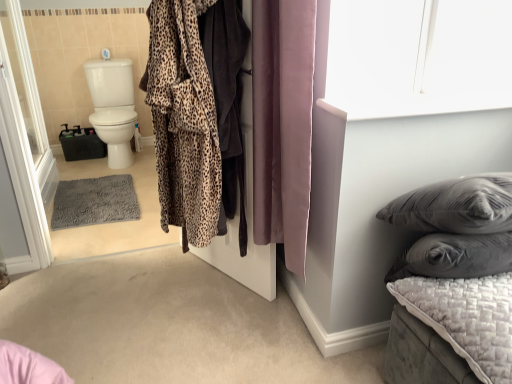
Describe the element at coordinates (453, 284) in the screenshot. I see `quilted gray cushion at lower right` at that location.

Locate an element on the screen. The image size is (512, 384). transparent glass screen door at left is located at coordinates (22, 172).

This screenshot has width=512, height=384. I want to click on quilted gray mattress at lower right, so click(x=466, y=318).

Identify the location of leopard print robe at center. This screenshot has height=384, width=512. (228, 101).

Is the depth of quilted gray mattress at lower right greater than that of leopard print plush bathrobe at center?

No, the depth of quilted gray mattress at lower right is less than that of leopard print plush bathrobe at center.

Is quilted gray mattress at lower right far from leopard print plush bathrobe at center?

That's not correct — quilted gray mattress at lower right is a little close to leopard print plush bathrobe at center.

From the image's perspective, is quilted gray mattress at lower right located beneath leopard print plush bathrobe at center?

Correct, quilted gray mattress at lower right appears lower than leopard print plush bathrobe at center in the image.

Can you confirm if quilted gray mattress at lower right is smaller than leopard print plush bathrobe at center?

Indeed, quilted gray mattress at lower right has a smaller size compared to leopard print plush bathrobe at center.

From a real-world perspective, is leopard print robe at center on top of purple velvet curtain at center?

No, from a real-world perspective, leopard print robe at center is not over purple velvet curtain at center

Is leopard print robe at center far away from purple velvet curtain at center?

That's not correct — leopard print robe at center is a little close to purple velvet curtain at center.

The height and width of the screenshot is (384, 512). Find the location of `cloak below the purple velvet curtain at center (from a real-world perspective)`. cloak below the purple velvet curtain at center (from a real-world perspective) is located at coordinates (228, 101).

Between transparent glass screen door at left and purple velvet curtain at center, which one has larger size?

transparent glass screen door at left.

Is transparent glass screen door at left spatially inside purple velvet curtain at center, or outside of it?

The correct answer is: outside.

Are transparent glass screen door at left and purple velvet curtain at center located far from each other?

Yes, transparent glass screen door at left and purple velvet curtain at center are located far from each other.

From a real-world perspective, is transparent glass screen door at left above or below purple velvet curtain at center?

In terms of real-world spatial position, transparent glass screen door at left is below purple velvet curtain at center.

Who is taller, leopard print plush bathrobe at center or leopard print robe at center?

Standing taller between the two is leopard print robe at center.

Considering the sizes of leopard print plush bathrobe at center and leopard print robe at center in the image, is leopard print plush bathrobe at center wider or thinner than leopard print robe at center?

Considering their sizes, leopard print plush bathrobe at center looks broader than leopard print robe at center.

Is leopard print plush bathrobe at center at the left side of leopard print robe at center?

Yes, leopard print plush bathrobe at center is to the left of leopard print robe at center.

Locate an element on the screen. This screenshot has width=512, height=384. bathrobe that appears above the leopard print robe at center (from the image's perspective) is located at coordinates (183, 121).

In the scene shown: From a real-world perspective, is quilted gray mattress at lower right located higher than purple velvet curtain at center?

No, from a real-world perspective, quilted gray mattress at lower right is not above purple velvet curtain at center.

Considering the positions of objects quilted gray mattress at lower right and purple velvet curtain at center in the image provided, who is more to the right, quilted gray mattress at lower right or purple velvet curtain at center?

Positioned to the right is quilted gray mattress at lower right.

From the image's perspective, which is below, quilted gray mattress at lower right or purple velvet curtain at center?

quilted gray mattress at lower right is shown below in the image.

Does quilted gray mattress at lower right turn towards purple velvet curtain at center?

No.

From a real-world perspective, is purple velvet curtain at center physically located above or below leopard print robe at center?

In terms of real-world spatial position, purple velvet curtain at center is above leopard print robe at center.

In the image, is purple velvet curtain at center on the left side or the right side of leopard print robe at center?

Clearly, purple velvet curtain at center is on the right of leopard print robe at center in the image.

Which is more to the left, quilted gray cushion at lower right or purple velvet curtain at center?

Positioned to the left is purple velvet curtain at center.

Can you confirm if quilted gray cushion at lower right is wider than purple velvet curtain at center?

Yes, quilted gray cushion at lower right is wider than purple velvet curtain at center.

Image resolution: width=512 pixels, height=384 pixels. Find the location of `mattress that is in front of the leopard print plush bathrobe at center`. mattress that is in front of the leopard print plush bathrobe at center is located at coordinates (466, 318).

Locate an element on the screen. The width and height of the screenshot is (512, 384). curtain positioned vertically above the leopard print robe at center (from a real-world perspective) is located at coordinates (283, 123).

Estimate the real-world distances between objects in this image. Which object is closer to quilted gray mattress at lower right, purple velvet curtain at center or quilted gray cushion at lower right?

Among the two, quilted gray cushion at lower right is located nearer to quilted gray mattress at lower right.

Based on their spatial positions, is transparent glass screen door at left or leopard print plush bathrobe at center further from quilted gray cushion at lower right?

transparent glass screen door at left.

Looking at the image, which one is located further to leopard print plush bathrobe at center, purple velvet curtain at center or quilted gray cushion at lower right?

quilted gray cushion at lower right.

Considering their positions, is leopard print robe at center positioned further to leopard print plush bathrobe at center than transparent glass screen door at left?

Among the two, transparent glass screen door at left is located further to leopard print plush bathrobe at center.

In the scene shown: From the image, which object appears to be farther from quilted gray cushion at lower right, leopard print plush bathrobe at center or quilted gray mattress at lower right?

Among the two, leopard print plush bathrobe at center is located further to quilted gray cushion at lower right.

From the image, which object appears to be farther from purple velvet curtain at center, leopard print robe at center or transparent glass screen door at left?

Among the two, transparent glass screen door at left is located further to purple velvet curtain at center.

Looking at the image, which one is located further to purple velvet curtain at center, quilted gray cushion at lower right or leopard print plush bathrobe at center?

quilted gray cushion at lower right lies further to purple velvet curtain at center than the other object.

Estimate the real-world distances between objects in this image. Which object is closer to quilted gray mattress at lower right, purple velvet curtain at center or leopard print robe at center?

purple velvet curtain at center lies closer to quilted gray mattress at lower right than the other object.

This screenshot has height=384, width=512. I want to click on mattress between transparent glass screen door at left and quilted gray cushion at lower right, so click(x=466, y=318).

The image size is (512, 384). Find the location of `cloak situated between leopard print plush bathrobe at center and purple velvet curtain at center from left to right`. cloak situated between leopard print plush bathrobe at center and purple velvet curtain at center from left to right is located at coordinates (228, 101).

Locate an element on the screen. This screenshot has width=512, height=384. mattress located between leopard print plush bathrobe at center and quilted gray cushion at lower right in the left-right direction is located at coordinates (466, 318).

This screenshot has height=384, width=512. In order to click on curtain between leopard print plush bathrobe at center and quilted gray mattress at lower right in this screenshot , I will do `click(283, 123)`.